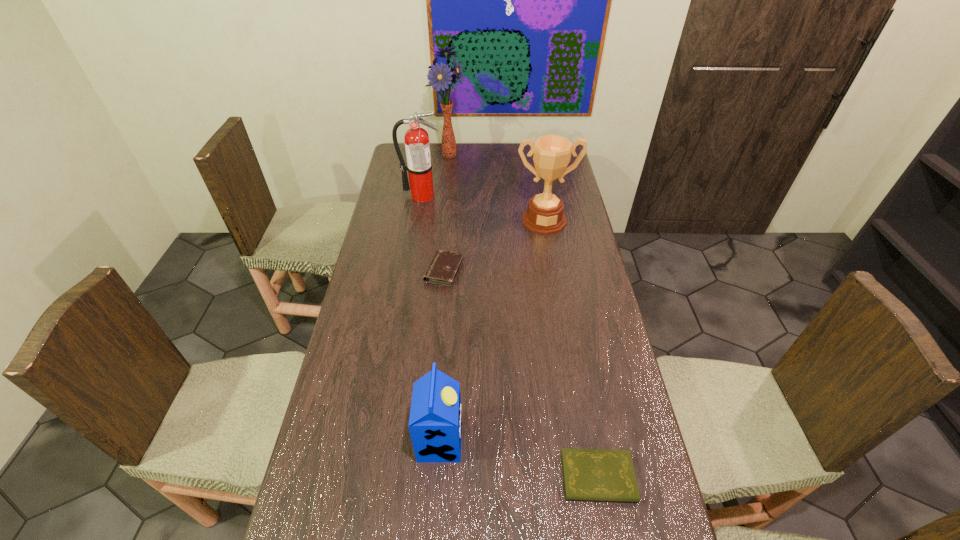
Where is `free space located on the nozzle side of the fire extinguisher`? free space located on the nozzle side of the fire extinguisher is located at coordinates (419, 218).

The height and width of the screenshot is (540, 960). Find the location of `vacant region located 0.230m on the front-facing side of the award`. vacant region located 0.230m on the front-facing side of the award is located at coordinates (553, 277).

You are a GUI agent. You are given a task and a screenshot of the screen. Output one action in this format:
    pyautogui.click(x=<x>, y=<y>)
    Task: Click on the vacant space located 0.180m with the cap open on the carton
    The height and width of the screenshot is (540, 960).
    Given the screenshot: What is the action you would take?
    pyautogui.click(x=533, y=441)

The width and height of the screenshot is (960, 540). What are the coordinates of `free spot located on the left of the left diary` in the screenshot? It's located at (411, 271).

Locate an element on the screen. The width and height of the screenshot is (960, 540). vacant area situated 0.070m on the left of the right diary is located at coordinates (533, 477).

Locate an element on the screen. Image resolution: width=960 pixels, height=540 pixels. object that is at the far edge is located at coordinates click(x=440, y=76).

The image size is (960, 540). I want to click on object situated at the left edge, so click(x=417, y=146).

Locate an element on the screen. award that is positioned at the right edge is located at coordinates (551, 154).

Locate an element on the screen. The image size is (960, 540). diary present at the right edge is located at coordinates (588, 474).

You are a GUI agent. You are given a task and a screenshot of the screen. Output one action in this format:
    pyautogui.click(x=<x>, y=<y>)
    Task: Click on the vacant region at the far edge of the desktop
    
    Given the screenshot: What is the action you would take?
    pyautogui.click(x=509, y=152)